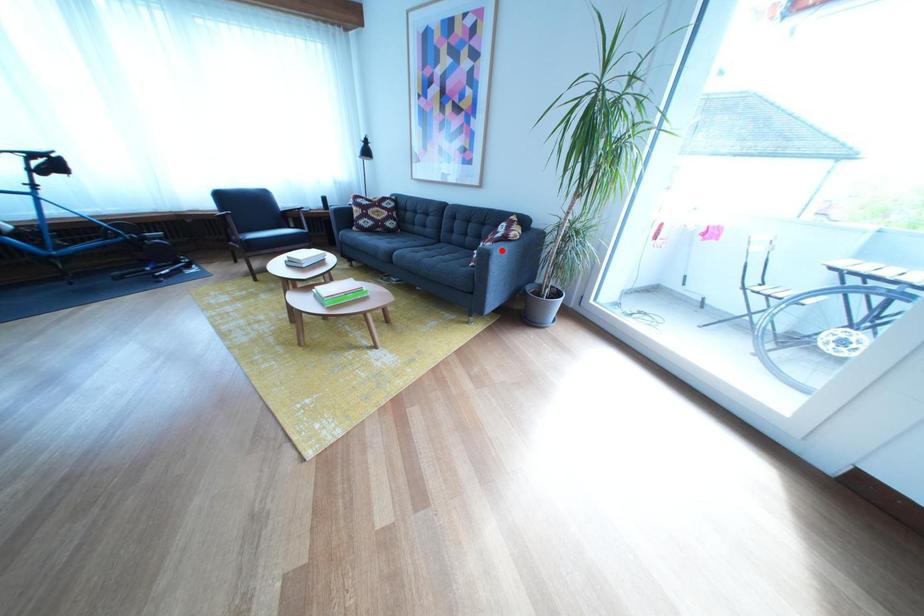
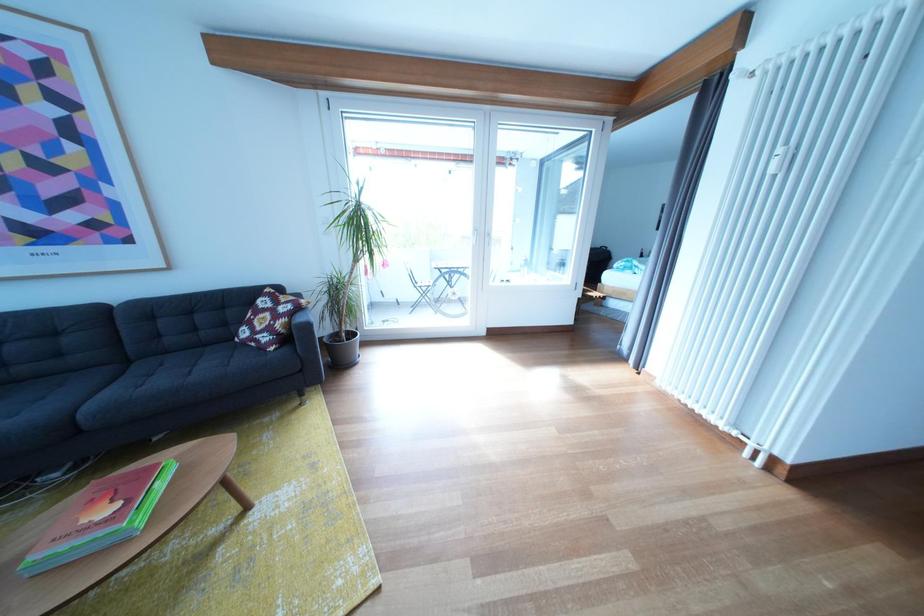
The point at the highlighted location is marked in the first image. Where is the corresponding point in the second image?

(296, 326)